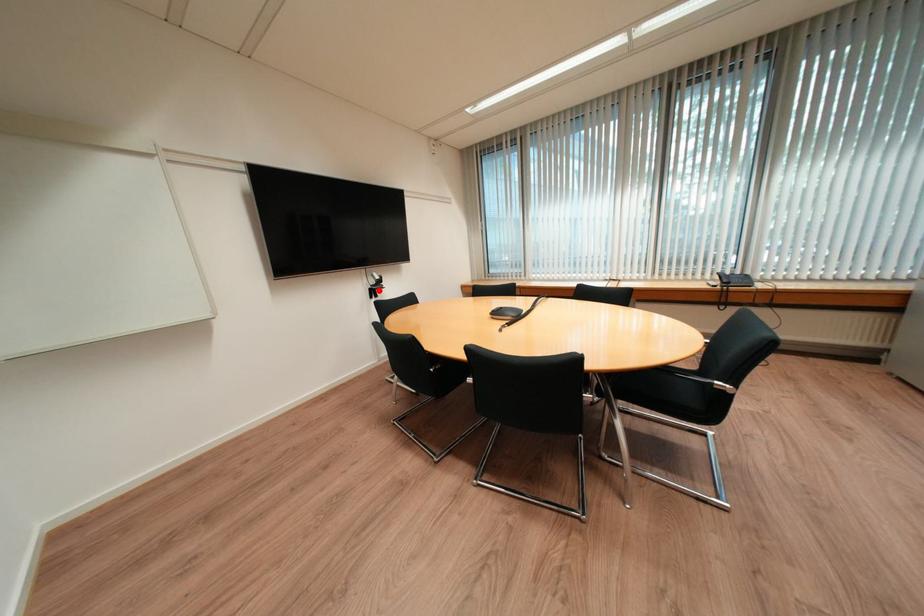
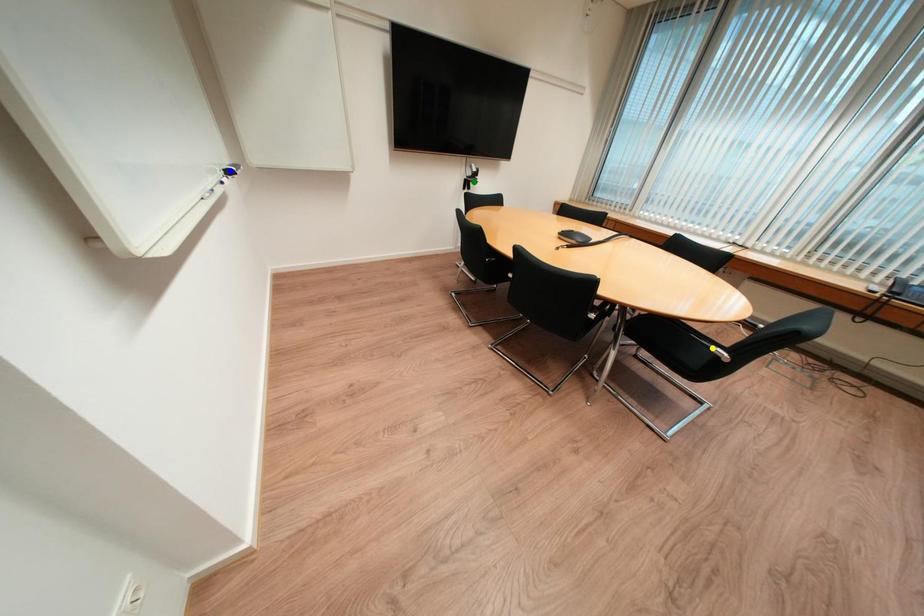
Question: I am providing you with two images of the same scene from different viewpoints. A red point is marked on the first image. You are given multiple points on the second image. Can you choose the point in image 2 that corresponds to the point in image 1?

Choices:
 (A) yellow point
 (B) blue point
 (C) green point

Answer: (C)